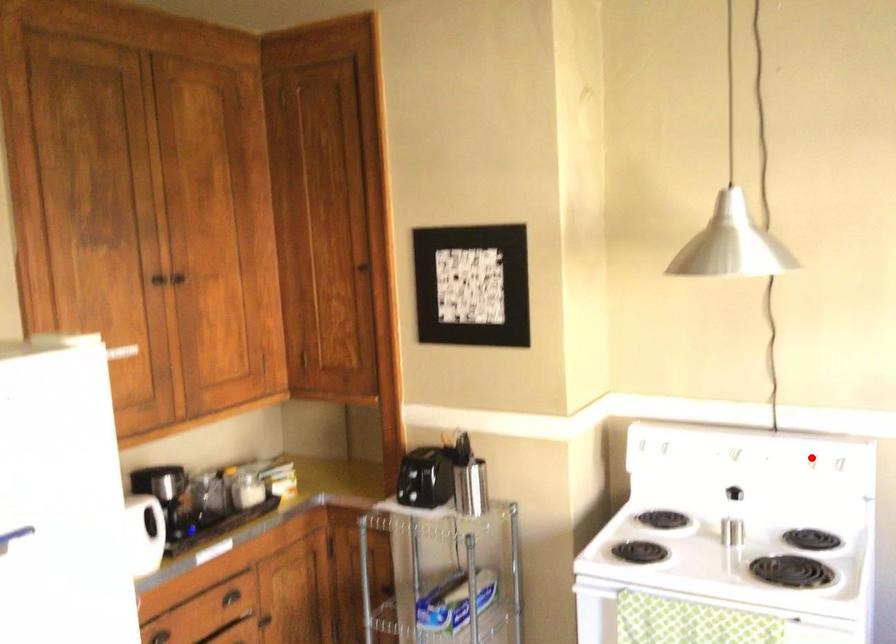
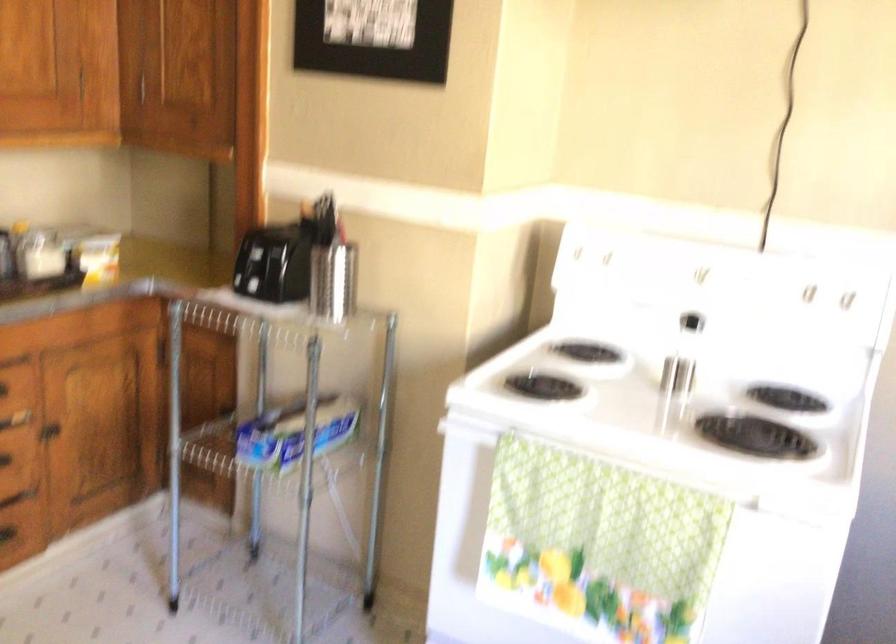
In the second image, find the point that corresponds to the highlighted location in the first image.

(805, 292)